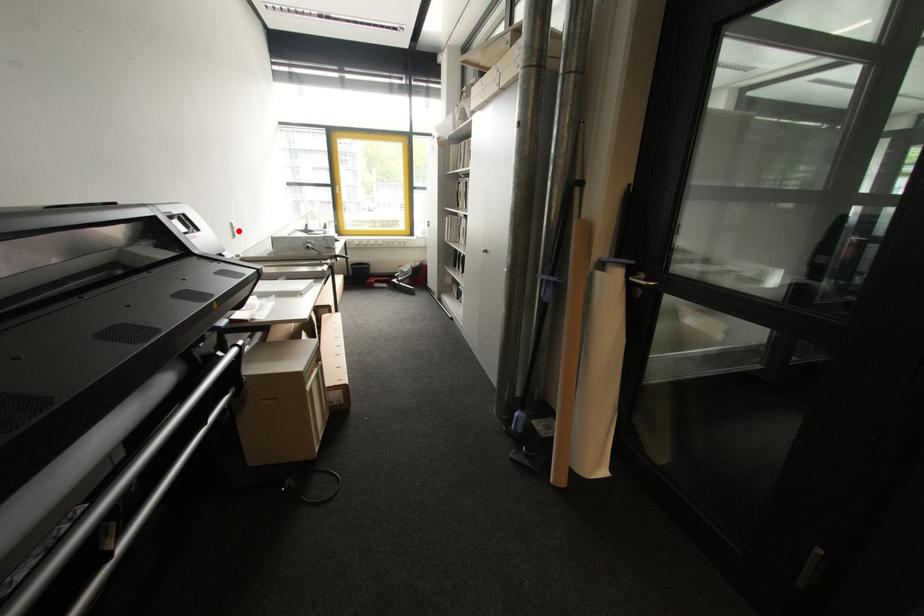
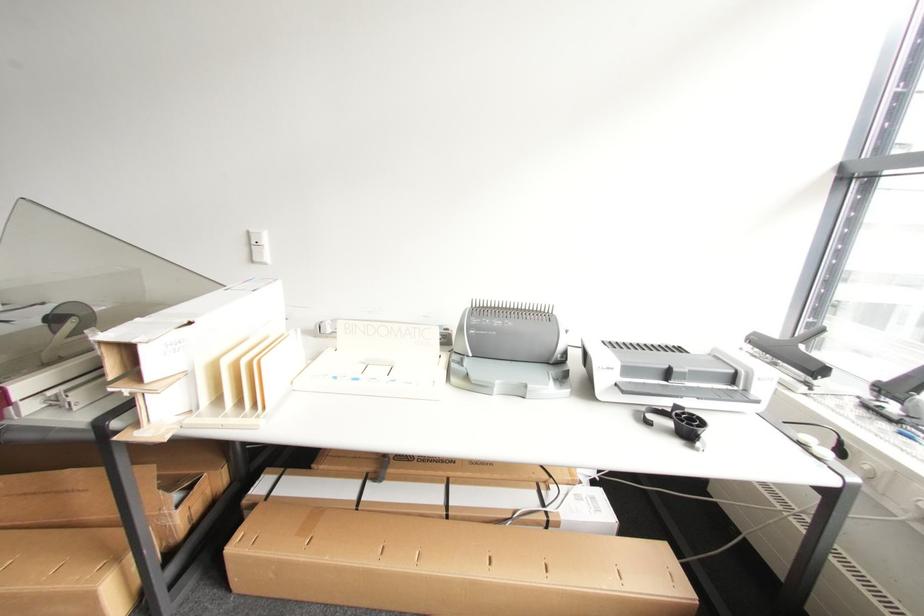
Question: I am providing you with two images of the same scene from different viewpoints. In image1, a red point is highlighted. Considering the same 3D point in image2, which of the following is correct?

Choices:
 (A) It is closer
 (B) It is farther

Answer: (B)